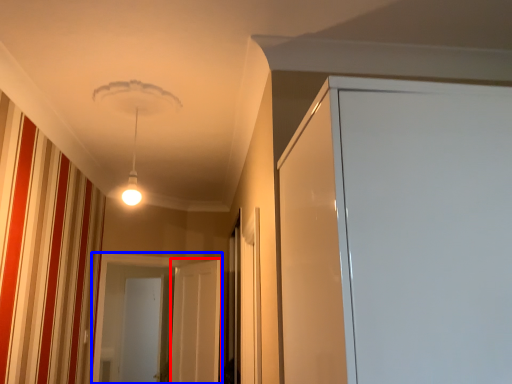
Question: Which point is further to the camera, screen door (highlighted by a red box) or screen door (highlighted by a blue box)?

Choices:
 (A) screen door
 (B) screen door

Answer: (B)